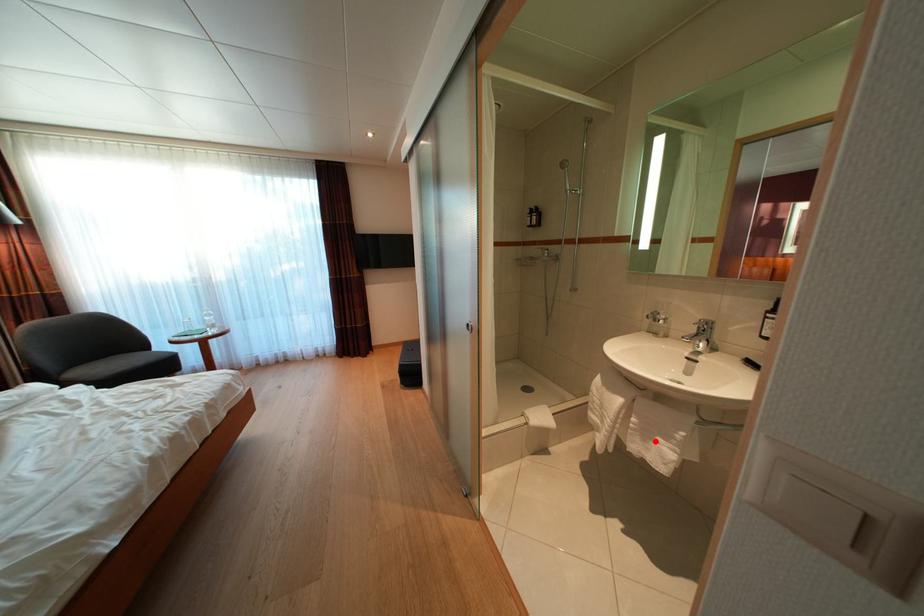
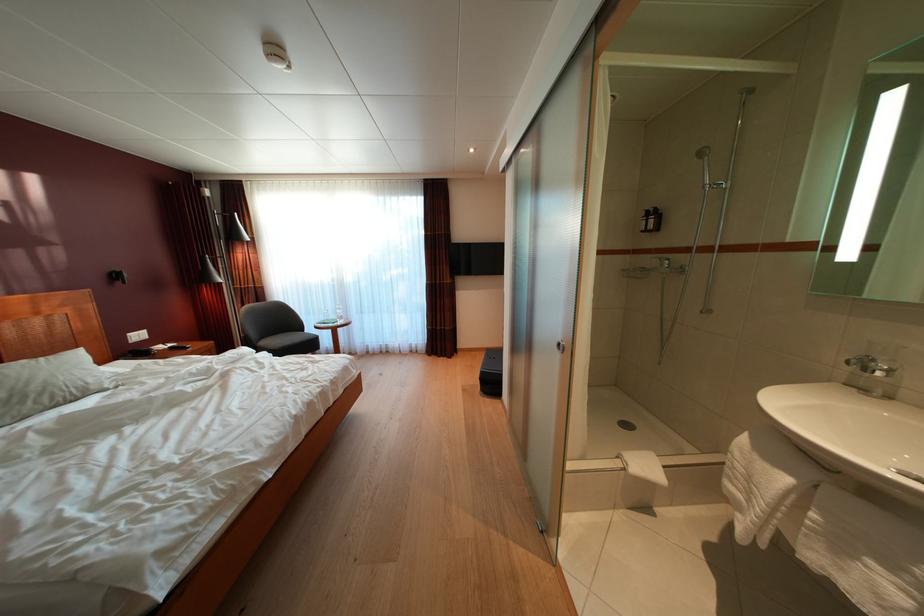
Find the pixel in the second image that matches the highlighted location in the first image.

(849, 554)